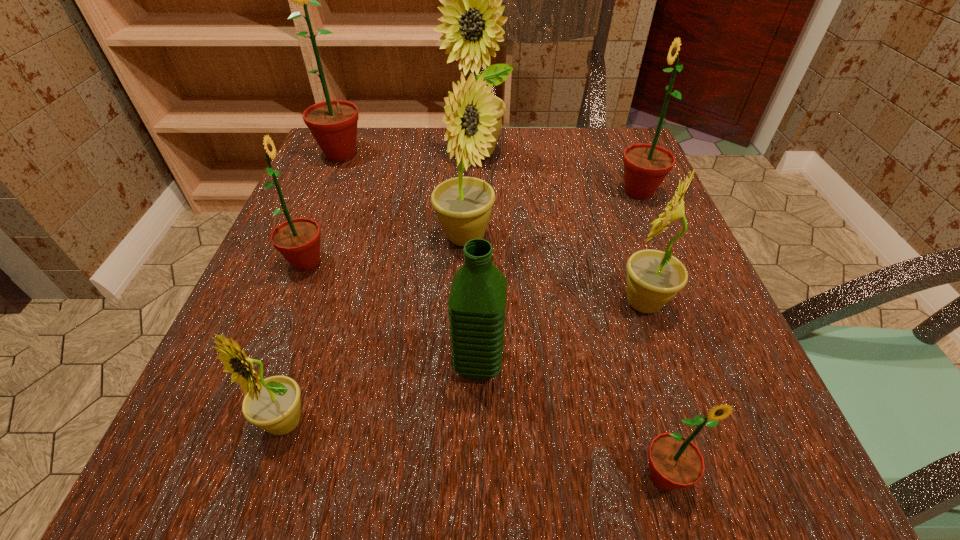
In the image, there is a desktop. Where is `vacant space at the far edge`? vacant space at the far edge is located at coordinates (560, 161).

This screenshot has width=960, height=540. Find the location of `vacant space at the near edge of the desktop`. vacant space at the near edge of the desktop is located at coordinates (531, 484).

The width and height of the screenshot is (960, 540). Identify the location of free space at the left edge. (354, 275).

In the image, there is a desktop. Identify the location of vacant area at the right edge. (648, 201).

What are the coordinates of `free location at the far left corner of the desktop` in the screenshot? It's located at [382, 175].

The image size is (960, 540). In the image, there is a desktop. What are the coordinates of `blank space at the far right corner` in the screenshot? It's located at (569, 127).

Identify the location of free spot at the near right corner of the desktop. Image resolution: width=960 pixels, height=540 pixels. (713, 436).

In order to click on blank region between the second nearest green sunflower and the nearest yellow sunflower in this screenshot , I will do pyautogui.click(x=296, y=342).

Identify the location of blank region between the seventh nearest object and the biggest yellow sunflower. The width and height of the screenshot is (960, 540). (557, 173).

Find the location of a particular element. This screenshot has height=540, width=960. vacant area that lies between the biggest yellow sunflower and the second nearest object is located at coordinates tap(379, 288).